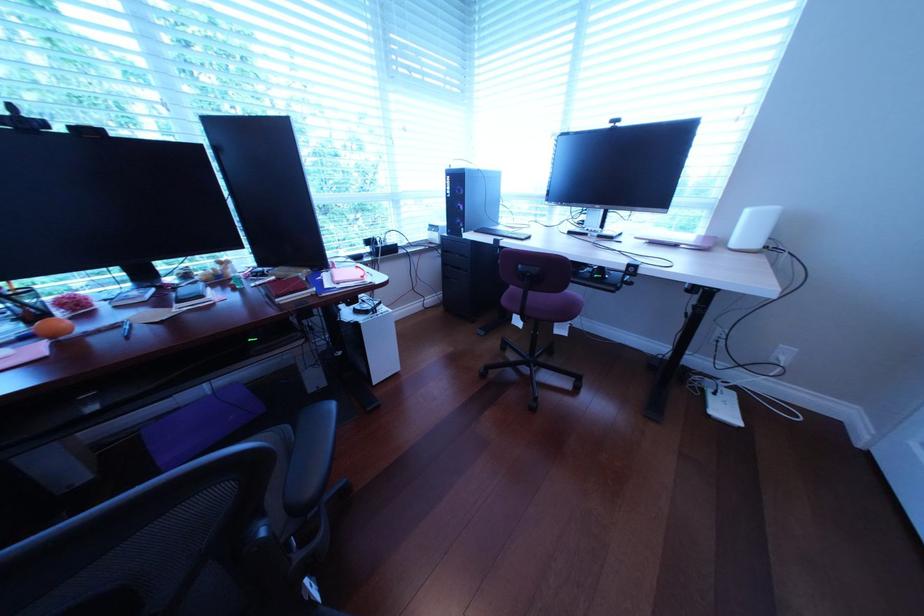
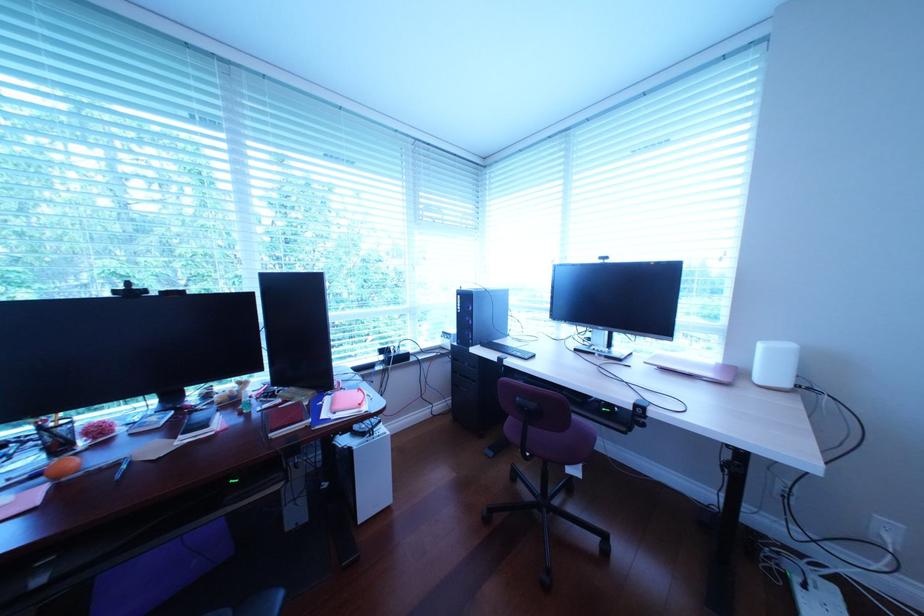
Question: How did the camera likely rotate?

Choices:
 (A) Left
 (B) Right
 (C) Up
 (D) Down

Answer: (C)